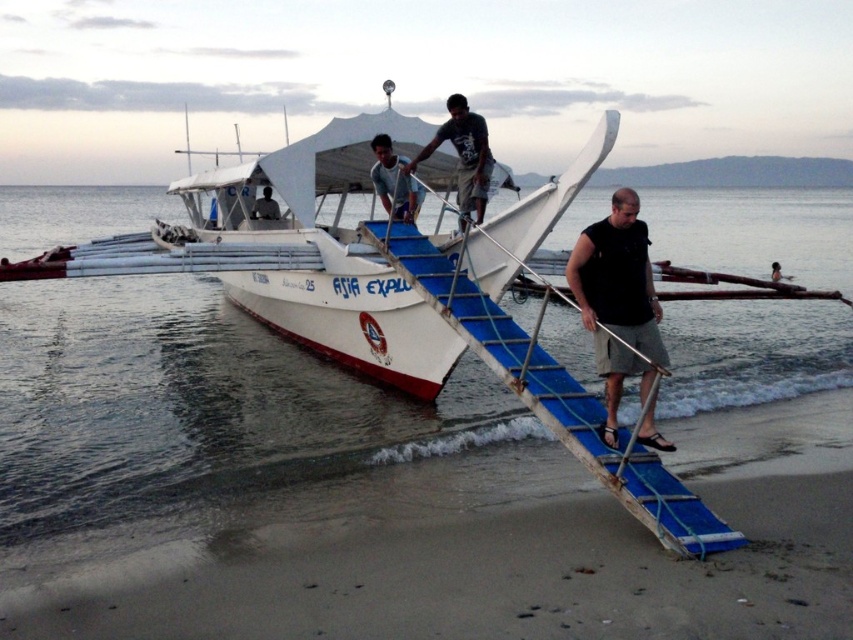
Does clear water at lower left appear on the right side of dark blue shirt at center?

In fact, clear water at lower left is to the left of dark blue shirt at center.

Is point (665, 248) behind point (485, 125)?

Yes, it is behind point (485, 125).

At what (x,y) coordinates should I click in order to perform the action: click on clear water at lower left. Please return your answer as a coordinate pair (x, y). The image size is (853, 640). Looking at the image, I should click on (218, 424).

Between blue plastic ladder at center and black fabric shirt at center, which one is positioned higher?

black fabric shirt at center is above.

What do you see at coordinates (553, 396) in the screenshot? This screenshot has height=640, width=853. I see `blue plastic ladder at center` at bounding box center [553, 396].

Identify the location of blue plastic ladder at center. This screenshot has height=640, width=853. (553, 396).

Which is in front, point (370, 259) or point (271, 202)?

Point (370, 259) is more forward.

Is point (509, 256) positioned behind point (271, 211)?

No, (509, 256) is in front of (271, 211).

You are a GUI agent. You are given a task and a screenshot of the screen. Output one action in this format:
    pyautogui.click(x=<x>, y=<y>)
    Task: Click on the white matte boat at center
    The height and width of the screenshot is (640, 853).
    Given the screenshot: What is the action you would take?
    pyautogui.click(x=329, y=257)